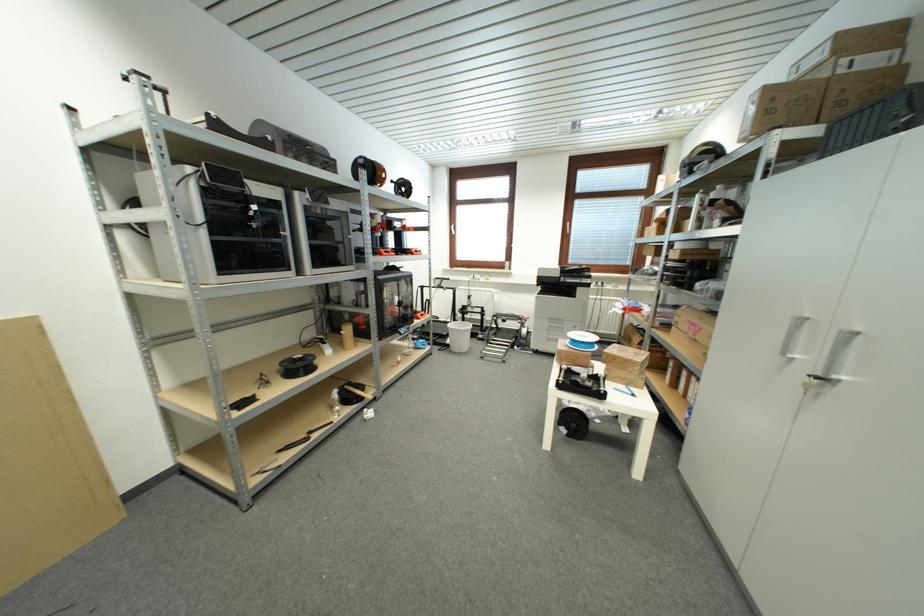
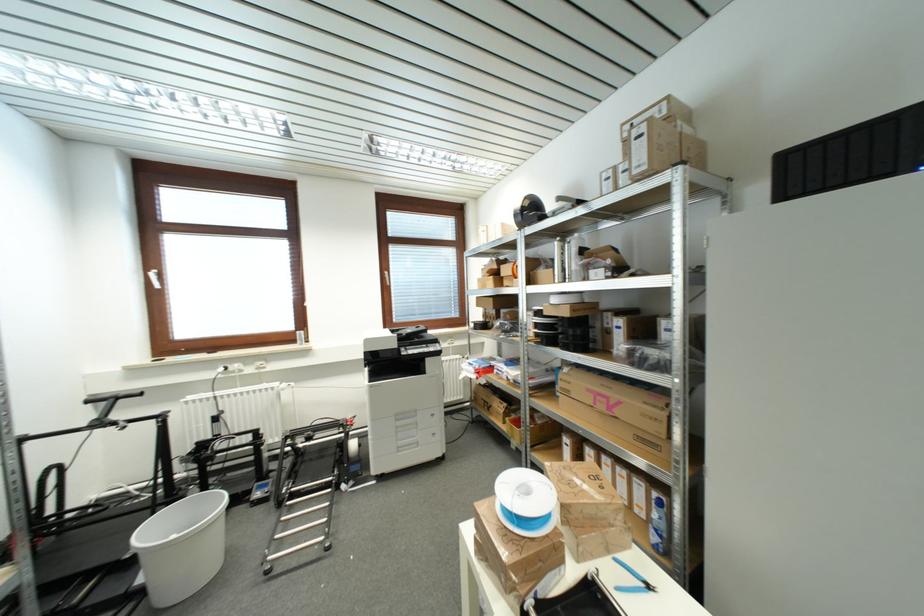
Find the pixel in the second image that matches point (453, 344) in the first image.

(144, 582)